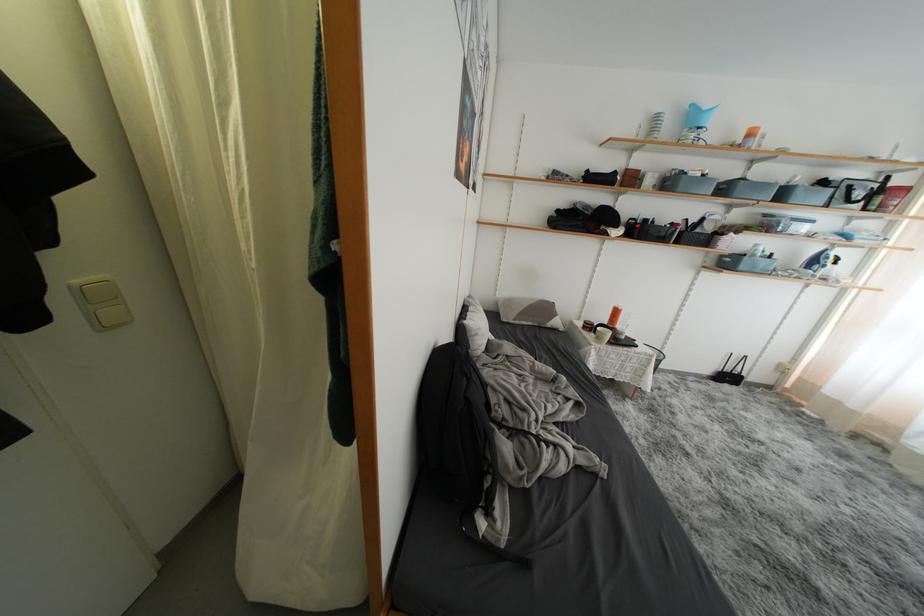
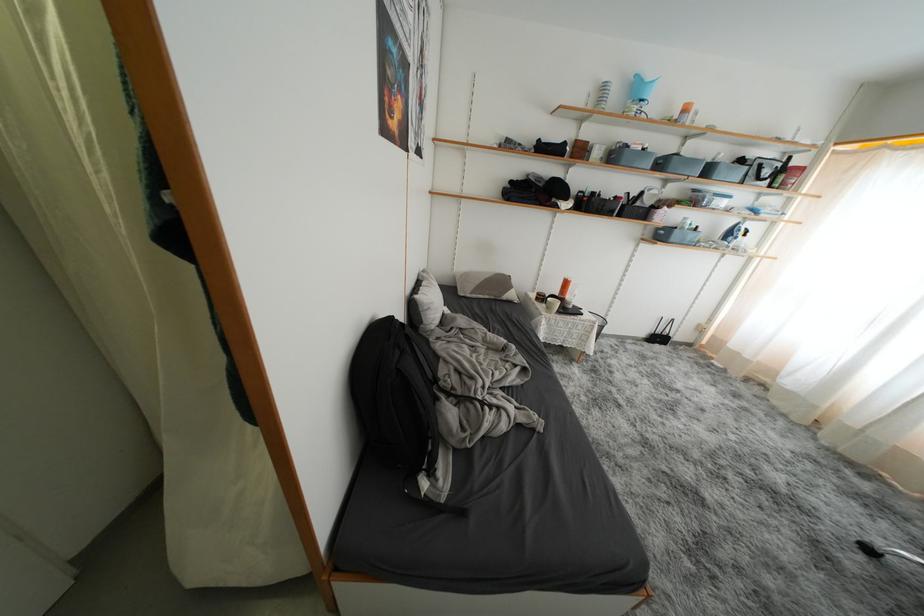
Question: Based on the continuous images, in which direction is the camera rotating? Reply with the corresponding letter.

Choices:
 (A) Left
 (B) Right
 (C) Up
 (D) Down

Answer: (B)